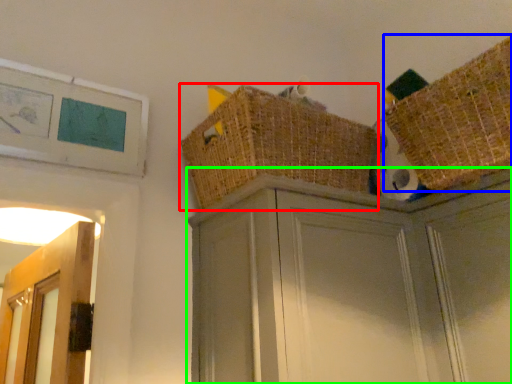
Question: Which object is the closest to the basket (highlighted by a red box)? Choose among these: basket (highlighted by a blue box) or cabinetry (highlighted by a green box).

Choices:
 (A) basket
 (B) cabinetry

Answer: (B)